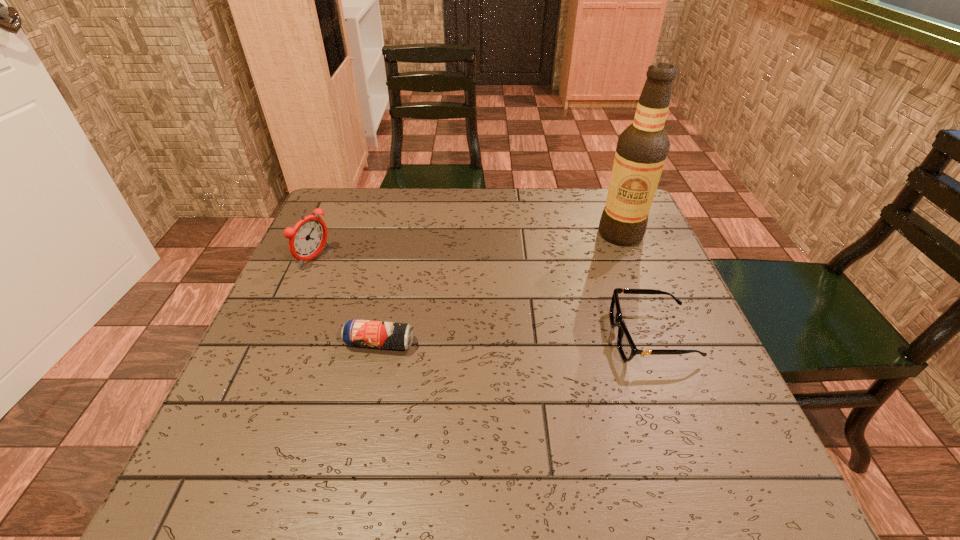
Locate an element on the screen. free space on the desktop that is between the third object from right to left and the sunglasses and is positioned on the label of the tallest object is located at coordinates (502, 340).

At what (x,y) coordinates should I click in order to perform the action: click on free spot on the desktop that is between the third object from right to left and the sunglasses and is positioned on the front-facing side of the alarm clock. Please return your answer as a coordinate pair (x, y). This screenshot has height=540, width=960. Looking at the image, I should click on (512, 340).